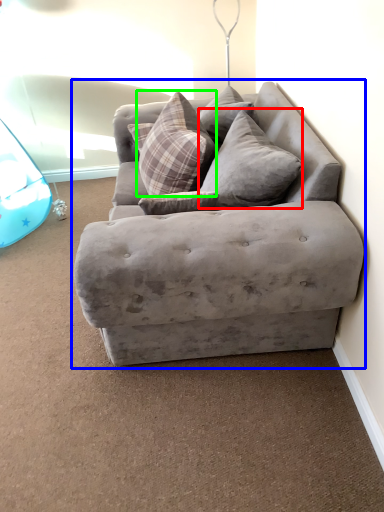
Question: Which object is the farthest from pillow (highlighted by a red box)? Choose among these: studio couch (highlighted by a blue box) or pillow (highlighted by a green box).

Choices:
 (A) studio couch
 (B) pillow

Answer: (A)